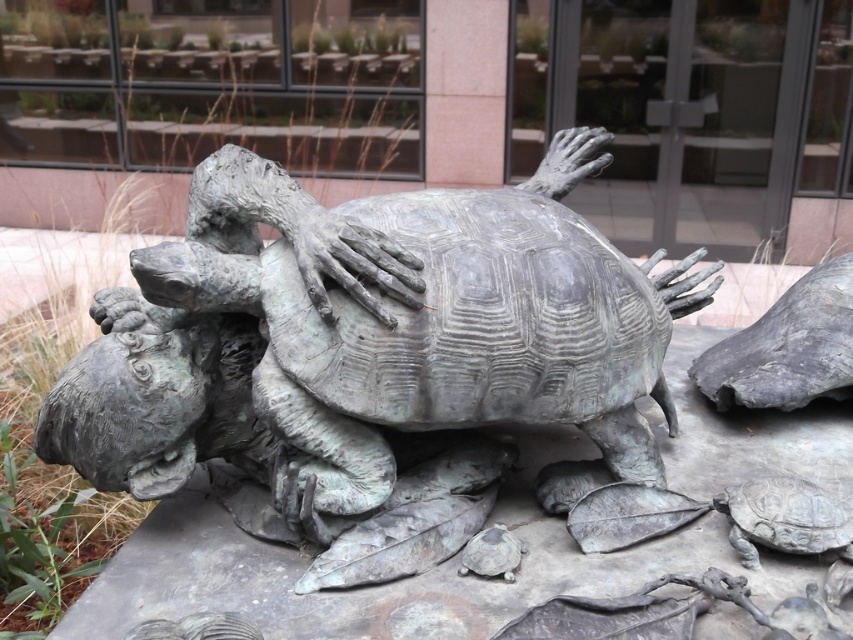
You are standing 5 feet away from the bronze textured tortoise at center. If you take one step forward, will you be closer than 3.78 feet to it?

The bronze textured tortoise at center is 3.78 feet away from the viewer. If you take one step forward from 5 feet away, you would be 5 minus the step length. Assuming an average step is about 2.5 feet, you would be 2.5 feet away, which is closer than 3.78 feet. However, if the step is shorter, say 1 foot, you would be 4 feet away, still farther than 3.78 feet. The answer depends on the step length.

You are standing in front of the sculpture and want to place a small flower pot exactly at the center of the base. Where should you place it relative to the bronze textured tortoise at center?

The bronze textured tortoise at center is located at point [426,316], which is very close to the center of the base. Therefore, placing the flower pot exactly at the center of the base would mean positioning it right near the bronze textured tortoise at center.